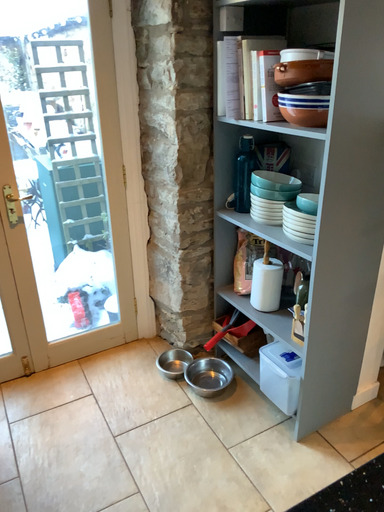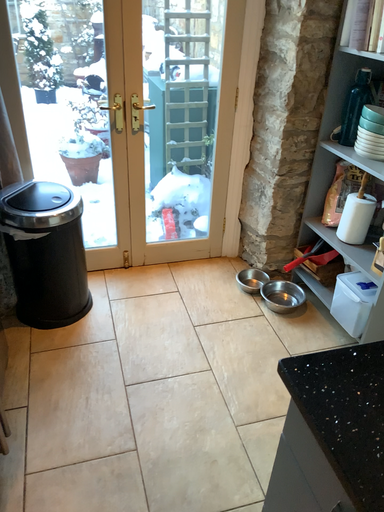
Question: How did the camera likely rotate when shooting the video?

Choices:
 (A) rotated downward
 (B) rotated upward

Answer: (A)